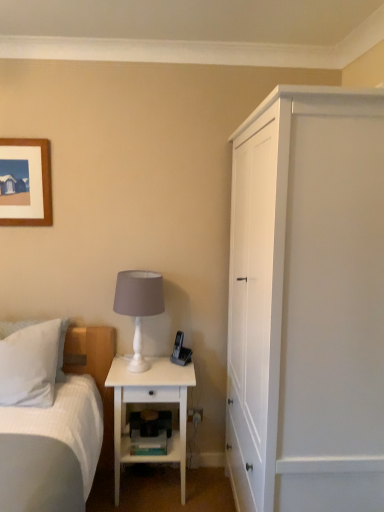
Where is `free spot below white matte table lamp at center (from a real-world perspective)`? free spot below white matte table lamp at center (from a real-world perspective) is located at coordinates (133, 370).